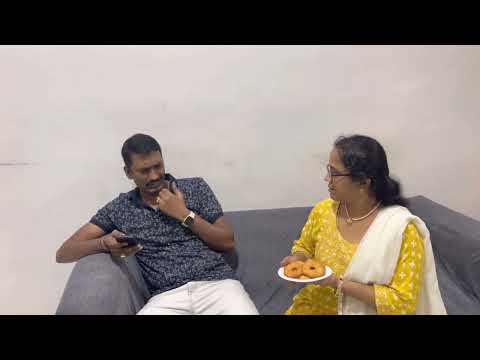
Find the location of a particular element. couch is located at coordinates (258, 231).